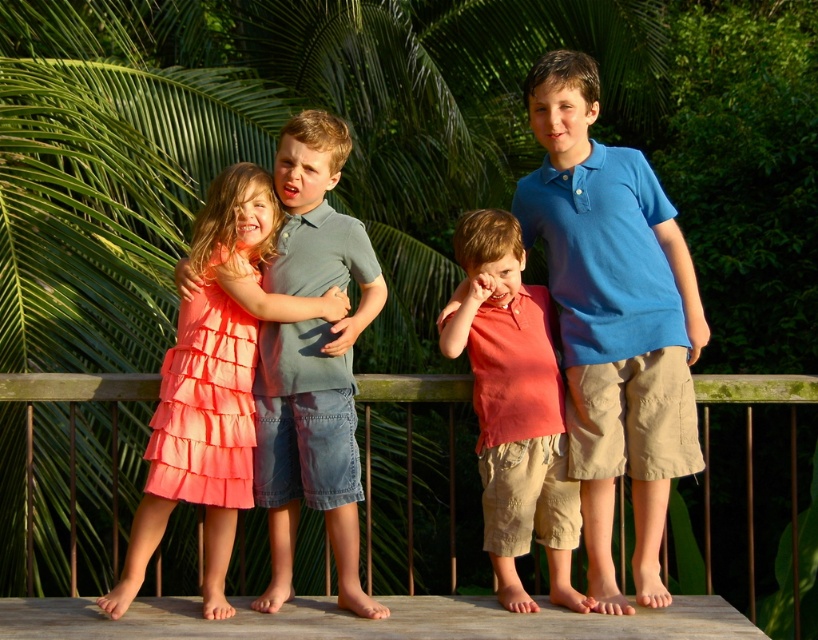
Does matte coral shirt at center have a smaller size compared to wooden at center?

Indeed, matte coral shirt at center has a smaller size compared to wooden at center.

Can you confirm if matte coral shirt at center is positioned to the left of wooden at center?

Indeed, matte coral shirt at center is positioned on the left side of wooden at center.

I want to click on matte coral shirt at center, so click(515, 408).

Is point (209, 275) closer to viewer compared to point (407, 602)?

Yes.

In the scene shown: Which is more to the left, matte coral dress at left or wooden at lower center?

matte coral dress at left is more to the left.

Which is behind, point (212, 328) or point (160, 600)?

Point (160, 600)

At what (x,y) coordinates should I click in order to perform the action: click on matte coral dress at left. Please return your answer as a coordinate pair (x, y). Image resolution: width=818 pixels, height=640 pixels. Looking at the image, I should click on (214, 381).

Looking at this image, is blue cotton shirt at center in front of wooden at center?

Yes, it is in front of wooden at center.

Between point (598, 173) and point (708, 442), which one is positioned behind?

The point (708, 442) is behind.

This screenshot has height=640, width=818. Describe the element at coordinates (614, 320) in the screenshot. I see `blue cotton shirt at center` at that location.

The width and height of the screenshot is (818, 640). I want to click on blue cotton shirt at center, so click(x=614, y=320).